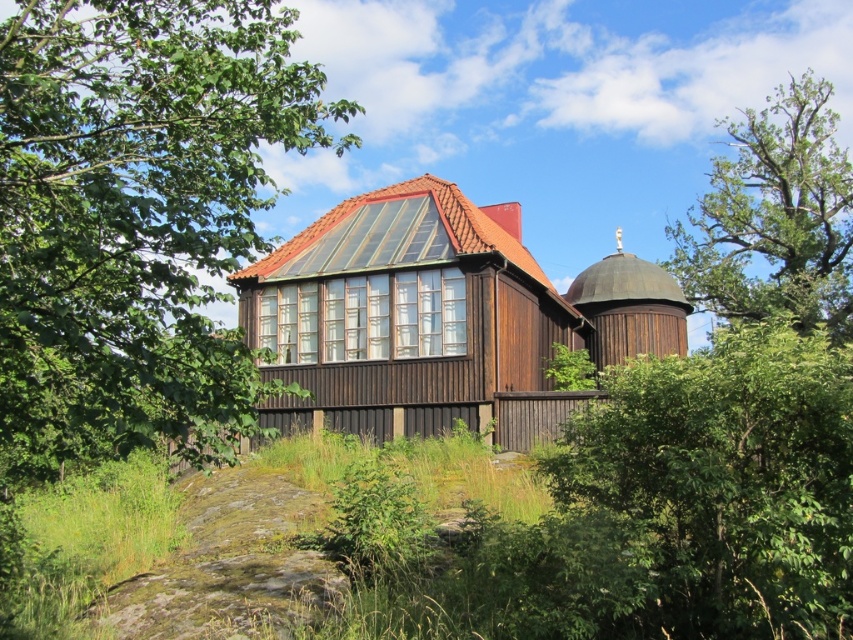
You are standing in front of the rustic wooden house and notice the green leafy tree at upper left and the green leafy bush at center. Which one is positioned higher in the image?

The green leafy tree at upper left is located above the green leafy bush at center, so it is positioned higher in the image.

You are standing in front of the rustic wooden house and see two points marked on the image. One is at point (x=59, y=164) and the other at point (x=728, y=404). Which point is closer to you?

Point (x=59, y=164) is in front of point (x=728, y=404), so it is closer to you.